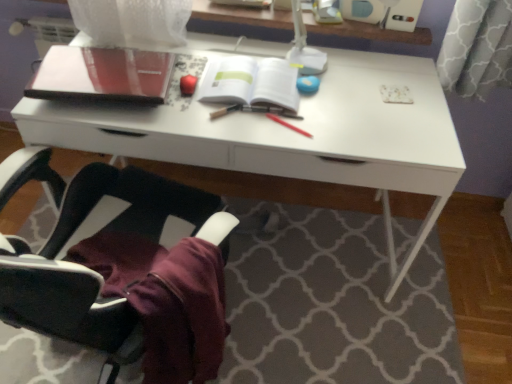
You are a GUI agent. You are given a task and a screenshot of the screen. Output one action in this format:
    pyautogui.click(x=<x>, y=<y>)
    Task: Click on the free area in between white glossy desk at center and black fabric chair at lower left
    
    Given the screenshot: What is the action you would take?
    pyautogui.click(x=296, y=334)